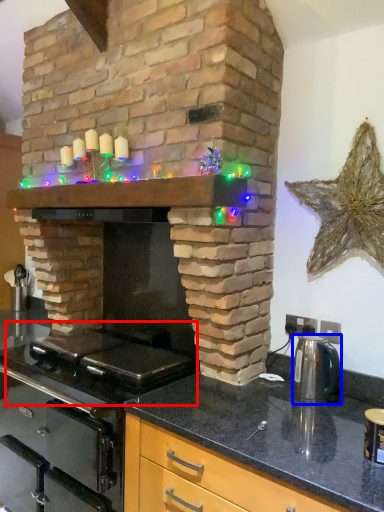
Question: Which point is closer to the camera, gas stove (highlighted by a red box) or kitchen appliance (highlighted by a blue box)?

Choices:
 (A) gas stove
 (B) kitchen appliance

Answer: (A)